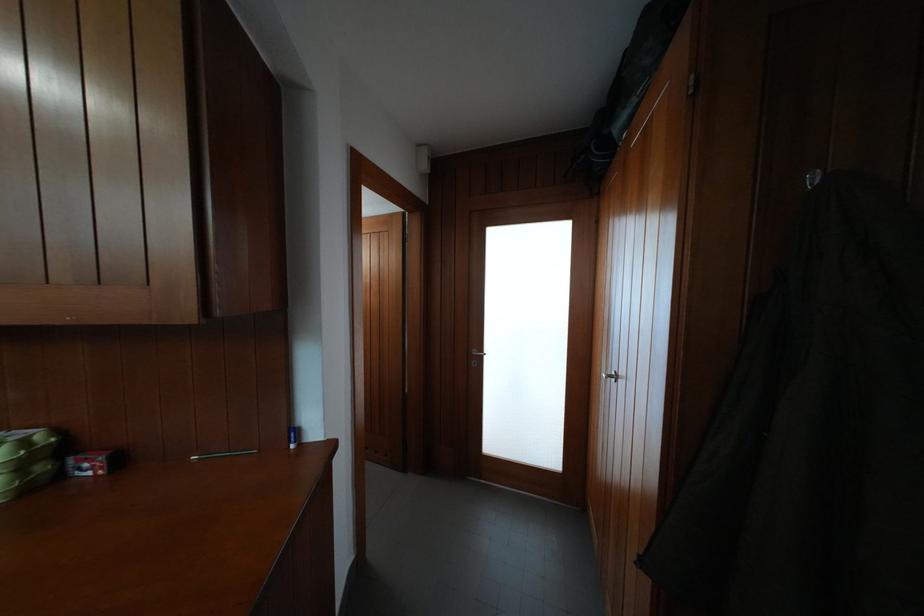
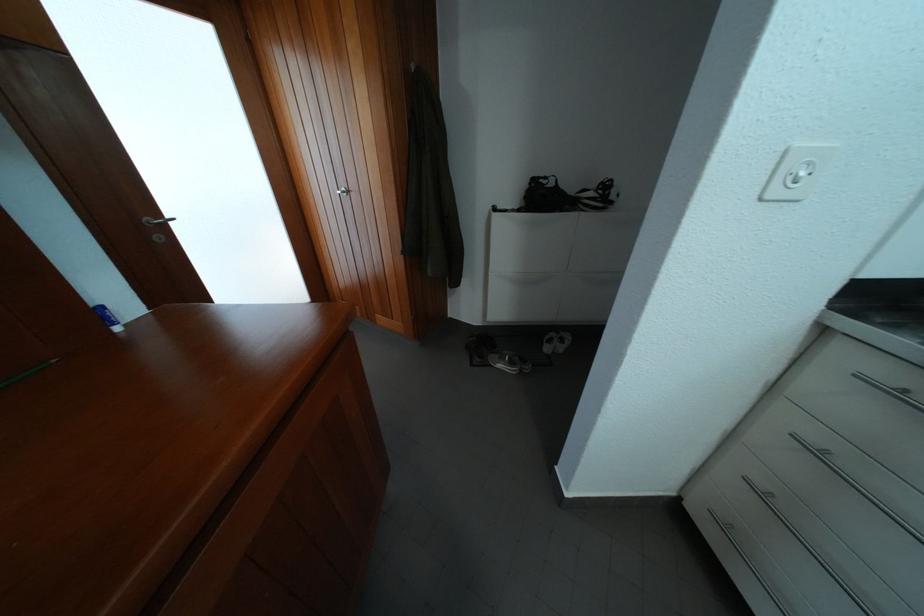
The images are taken continuously from a first-person perspective. In which direction is your viewpoint rotating?

The camera rotated toward right-down.